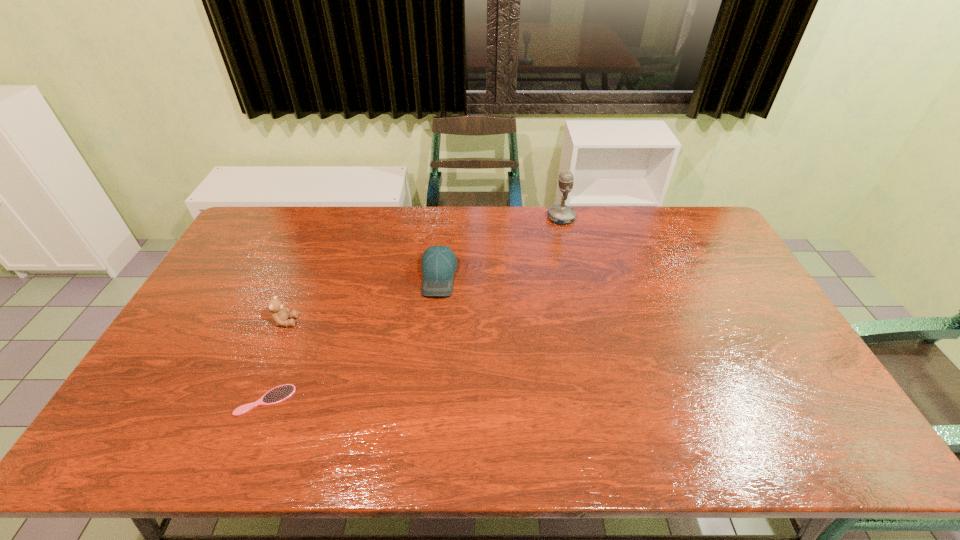
This screenshot has height=540, width=960. I want to click on free spot between the farthest object and the baseball cap, so click(500, 247).

Find the location of `vacant region between the rightmost object and the baseball cap`. vacant region between the rightmost object and the baseball cap is located at coordinates (500, 247).

The height and width of the screenshot is (540, 960). What are the coordinates of `free space between the second object from right to left and the tallest object` in the screenshot? It's located at (500, 247).

Image resolution: width=960 pixels, height=540 pixels. Identify the location of empty space that is in between the microphone and the hairbrush. [x=414, y=309].

Where is `free space between the teddy bear and the shortest object`? free space between the teddy bear and the shortest object is located at coordinates tap(276, 361).

In order to click on vacant area between the baseball cap and the shortest object in this screenshot , I will do `click(352, 338)`.

The height and width of the screenshot is (540, 960). Identify the location of free area in between the shortest object and the baseball cap. (352, 338).

Locate an element on the screen. The width and height of the screenshot is (960, 540). the closest object to the hairbrush is located at coordinates (280, 314).

You are a GUI agent. You are given a task and a screenshot of the screen. Output one action in this format:
    pyautogui.click(x=<x>, y=<y>)
    Task: Click on the third closest object to the third object from left to right
    This screenshot has height=540, width=960.
    Given the screenshot: What is the action you would take?
    pyautogui.click(x=276, y=395)

Find the location of a particular element. vacant region that satisfies the following two spatial constraints: 1. on the face of the teddy bear; 2. on the back side of the nearest object is located at coordinates (x=252, y=400).